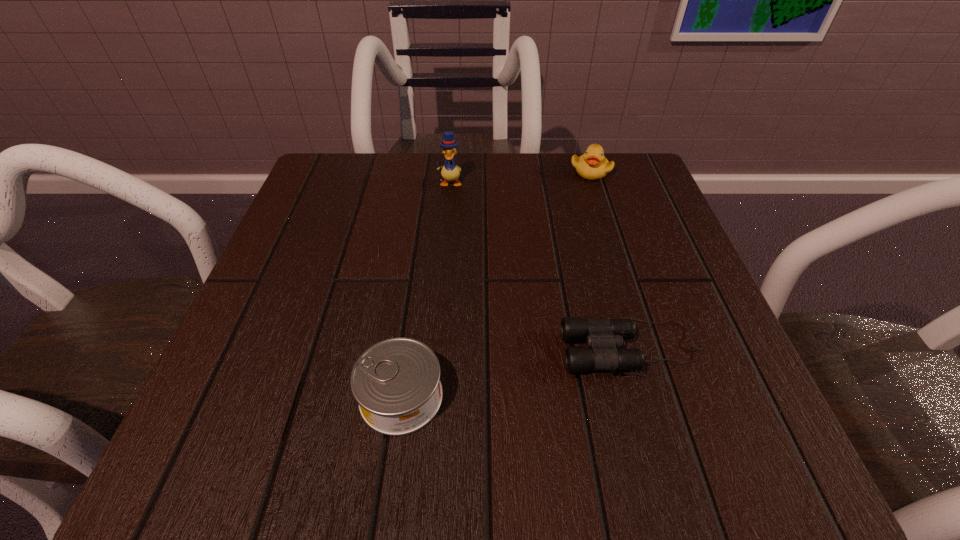
This screenshot has height=540, width=960. I want to click on vacant space located 0.240m at the eyepiece of the binoculars, so click(x=401, y=348).

This screenshot has height=540, width=960. I want to click on object that is at the near edge, so click(x=396, y=382).

You are a GUI agent. You are given a task and a screenshot of the screen. Output one action in this format:
    pyautogui.click(x=<x>, y=<y>)
    Task: Click on the duckling that is at the right edge
    This screenshot has width=960, height=540.
    Given the screenshot: What is the action you would take?
    pyautogui.click(x=592, y=165)

Where is `binoculars that is at the right edge`? Image resolution: width=960 pixels, height=540 pixels. binoculars that is at the right edge is located at coordinates (603, 335).

Where is `object at the far right corner`? The width and height of the screenshot is (960, 540). object at the far right corner is located at coordinates (592, 165).

Where is `vacant space at the far edge of the desktop`? Image resolution: width=960 pixels, height=540 pixels. vacant space at the far edge of the desktop is located at coordinates click(434, 186).

Find the location of a particular element. This screenshot has height=540, width=960. free region at the left edge of the desktop is located at coordinates (348, 229).

In the image, there is a desktop. Where is `vacant region at the right edge`? Image resolution: width=960 pixels, height=540 pixels. vacant region at the right edge is located at coordinates [x=620, y=252].

In order to click on vacant space at the far left corner in this screenshot , I will do `click(330, 170)`.

Locate an element on the screen. This screenshot has height=540, width=960. vacant space at the near left corner of the desktop is located at coordinates (303, 443).